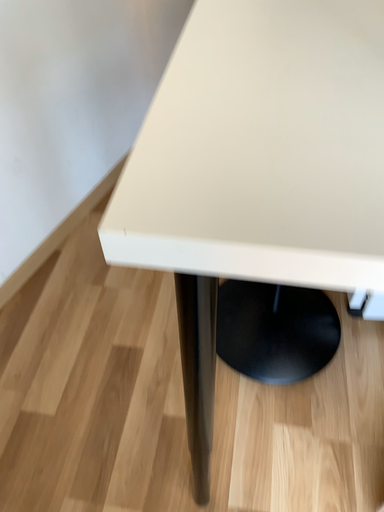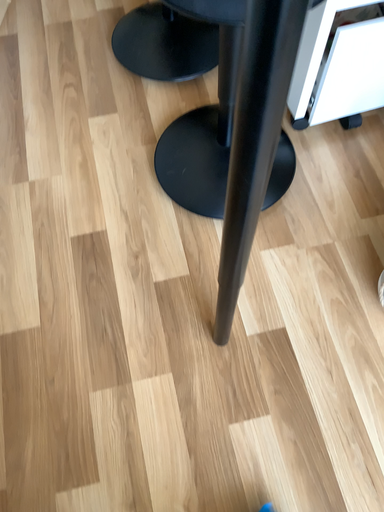
Question: Which way did the camera rotate in the video?

Choices:
 (A) rotated right
 (B) rotated left

Answer: (A)